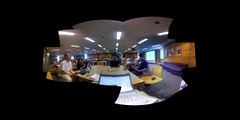
Where is `purple couch`? The image size is (240, 120). purple couch is located at coordinates (176, 67).